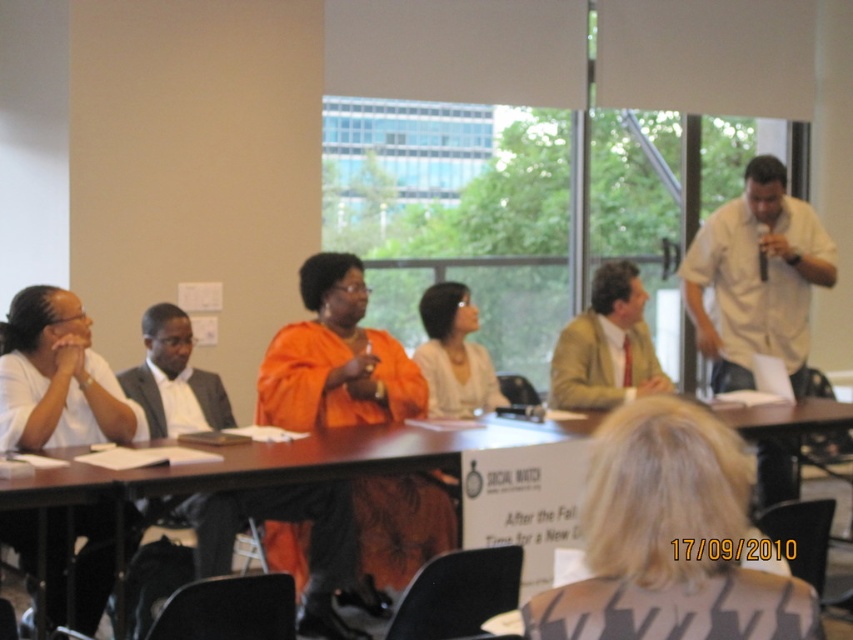
Question: Among these points, which one is nearest to the camera?

Choices:
 (A) (605, 376)
 (B) (712, 337)

Answer: (A)

Question: Is white shirt at right positioned before light brown leather jacket at center?

Choices:
 (A) yes
 (B) no

Answer: (B)

Question: Which object is the farthest from the white shirt at right?

Choices:
 (A) wooden table at center
 (B) light brown leather jacket at center

Answer: (A)

Question: Which of the following is the closest to the observer?

Choices:
 (A) white shirt at right
 (B) light brown leather jacket at center

Answer: (B)

Question: Is white shirt at right smaller than light brown leather jacket at center?

Choices:
 (A) no
 (B) yes

Answer: (A)

Question: Where is white shirt at right located in relation to light brown leather jacket at center in the image?

Choices:
 (A) above
 (B) below

Answer: (A)